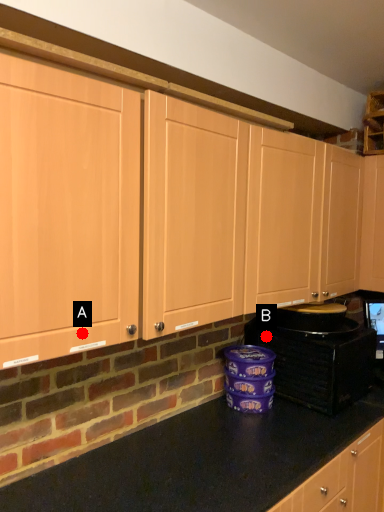
Question: Two points are circled on the image, labeled by A and B beside each circle. Which of the following is the farthest from the observer?

Choices:
 (A) A is further
 (B) B is further

Answer: (B)